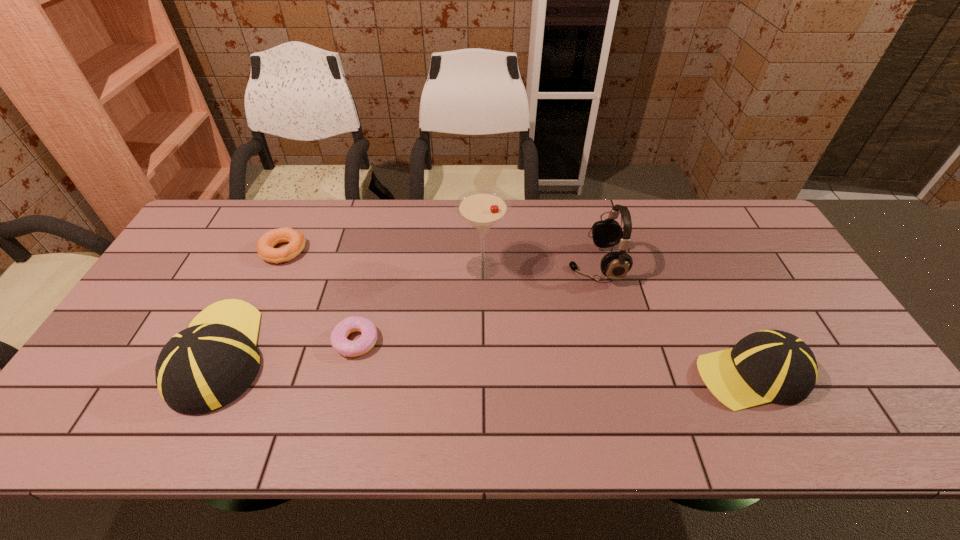
Find the location of a particular element. vacant space at the near left corner is located at coordinates (113, 377).

Where is `empty location between the doughnut and the bagel`? The image size is (960, 540). empty location between the doughnut and the bagel is located at coordinates (320, 296).

Where is `vacant area that lies between the third tallest object and the bagel`? The image size is (960, 540). vacant area that lies between the third tallest object and the bagel is located at coordinates (252, 303).

This screenshot has height=540, width=960. I want to click on free space between the right baseball cap and the left baseball cap, so click(x=485, y=364).

This screenshot has height=540, width=960. Find the location of `empty space between the taller baseball cap and the fourth tallest object`. empty space between the taller baseball cap and the fourth tallest object is located at coordinates (485, 364).

The width and height of the screenshot is (960, 540). Identify the location of unoccupied area between the fifth shortest object and the doughnut. (476, 302).

Identify the location of free area in between the bagel and the fourth shortest object. The height and width of the screenshot is (540, 960). (252, 303).

Locate an element on the screen. The width and height of the screenshot is (960, 540). vacant space that is in between the second tallest object and the bagel is located at coordinates (440, 258).

Locate an element on the screen. This screenshot has height=540, width=960. blank region between the bagel and the shorter baseball cap is located at coordinates (517, 313).

I want to click on blank region between the bagel and the third object from left to right, so click(320, 296).